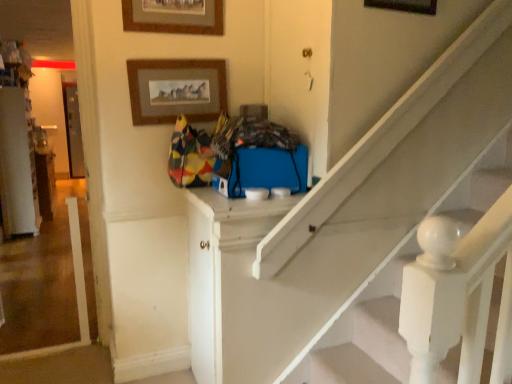
Question: Can you confirm if wooden picture frame at upper center, the 3th picture frame when ordered from right to left, is positioned to the right of white painted wood door at center, placed as the second door when sorted from right to left?

Choices:
 (A) yes
 (B) no

Answer: (B)

Question: Is wooden picture frame at upper center, which is counted as the 1th picture frame, starting from the left, looking in the opposite direction of white painted wood door at center, the 1th door from the left?

Choices:
 (A) no
 (B) yes

Answer: (A)

Question: Can you confirm if wooden picture frame at upper center, which is counted as the 1th picture frame, starting from the left, is positioned to the left of white painted wood door at center, the first door in the bottom-to-top sequence?

Choices:
 (A) yes
 (B) no

Answer: (A)

Question: Is wooden picture frame at upper center, the 3th picture frame when ordered from right to left, with white painted wood door at center, the first door in the bottom-to-top sequence?

Choices:
 (A) no
 (B) yes

Answer: (A)

Question: Does wooden picture frame at upper center, the 3th picture frame when ordered from right to left, have a larger size compared to white painted wood door at center, the 1th door from the left?

Choices:
 (A) yes
 (B) no

Answer: (B)

Question: Is point (189, 11) closer or farther from the camera than point (181, 71)?

Choices:
 (A) closer
 (B) farther

Answer: (A)

Question: Which is correct: wooden picture frame at upper center, which is counted as the 1th picture frame, starting from the left, is inside wooden picture frame at upper center, which ranks as the 2th picture frame in left-to-right order, or outside of it?

Choices:
 (A) inside
 (B) outside

Answer: (B)

Question: Is wooden picture frame at upper center, which is counted as the 1th picture frame, starting from the left, bigger or smaller than wooden picture frame at upper center, which ranks as the 2th picture frame in left-to-right order?

Choices:
 (A) big
 (B) small

Answer: (B)

Question: From the image's perspective, is wooden picture frame at upper center, the 3th picture frame when ordered from right to left, located above or below wooden picture frame at upper center, which ranks as the 2th picture frame in left-to-right order?

Choices:
 (A) below
 (B) above

Answer: (B)

Question: Considering the positions of point (320, 162) and point (150, 92), is point (320, 162) closer or farther from the camera than point (150, 92)?

Choices:
 (A) farther
 (B) closer

Answer: (B)

Question: From the image's perspective, is matte blue door at upper center, acting as the second door starting from the bottom, above or below wooden picture frame at upper center, the 2th picture frame when ordered from right to left?

Choices:
 (A) above
 (B) below

Answer: (B)

Question: In terms of size, does matte blue door at upper center, marked as the 1th door in a right-to-left arrangement, appear bigger or smaller than wooden picture frame at upper center, which ranks as the 2th picture frame in left-to-right order?

Choices:
 (A) small
 (B) big

Answer: (B)

Question: Which is correct: matte blue door at upper center, acting as the second door starting from the bottom, is inside wooden picture frame at upper center, the 2th picture frame when ordered from right to left, or outside of it?

Choices:
 (A) outside
 (B) inside

Answer: (A)

Question: From a real-world perspective, is matte blue door at upper center, marked as the 1th door in a right-to-left arrangement, positioned above or below wooden picture frame at upper center, the 3th picture frame when ordered from right to left?

Choices:
 (A) above
 (B) below

Answer: (B)

Question: Is point (288, 76) closer or farther from the camera than point (176, 23)?

Choices:
 (A) closer
 (B) farther

Answer: (A)